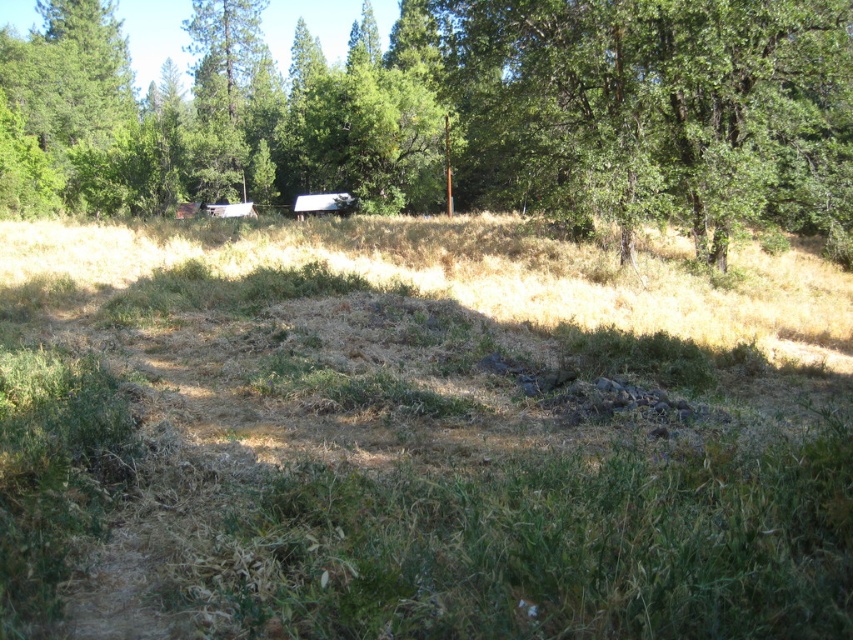
Does green grass at center have a lesser width compared to green leafy tree at upper center?

Correct, green grass at center's width is less than green leafy tree at upper center's.

How distant is green grass at center from green leafy tree at upper center?

green grass at center is 22.09 meters from green leafy tree at upper center.

I want to click on green grass at center, so click(x=416, y=433).